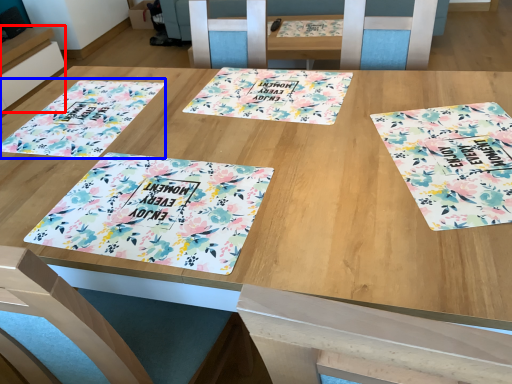
Question: Which object appears closest to the camera in this image, table (highlighted by a red box) or tablecloth (highlighted by a blue box)?

Choices:
 (A) table
 (B) tablecloth

Answer: (B)